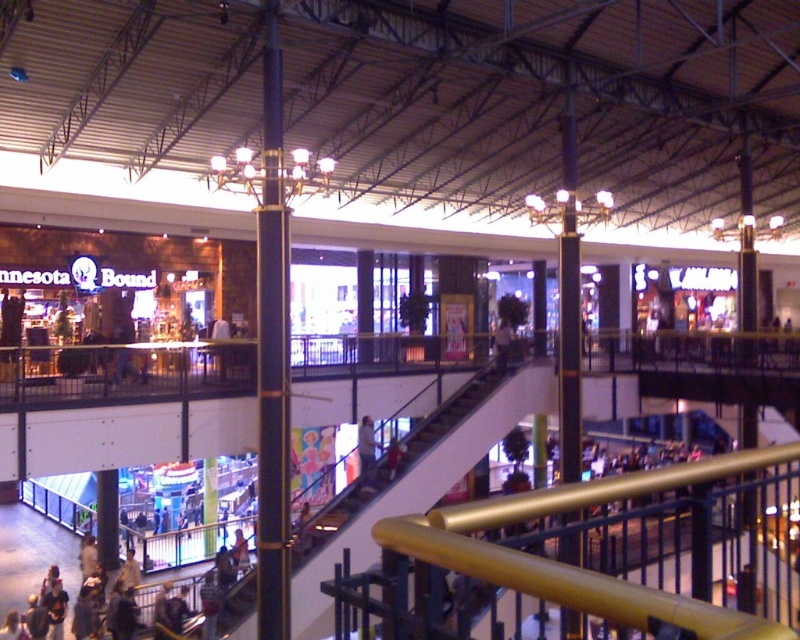
Question: Is white plastic escalator at center bigger than light blue jeans at center?

Choices:
 (A) yes
 (B) no

Answer: (A)

Question: Observing the image, what is the correct spatial positioning of white plastic escalator at center in reference to light blue jeans at center?

Choices:
 (A) left
 (B) right

Answer: (B)

Question: Is the position of white plastic escalator at center less distant than that of light blue jeans at center?

Choices:
 (A) no
 (B) yes

Answer: (B)

Question: Which point appears closest to the camera in this image?

Choices:
 (A) 366,472
 (B) 424,477

Answer: (A)

Question: Which object is farther from the camera taking this photo?

Choices:
 (A) light blue jeans at center
 (B) white plastic escalator at center

Answer: (A)